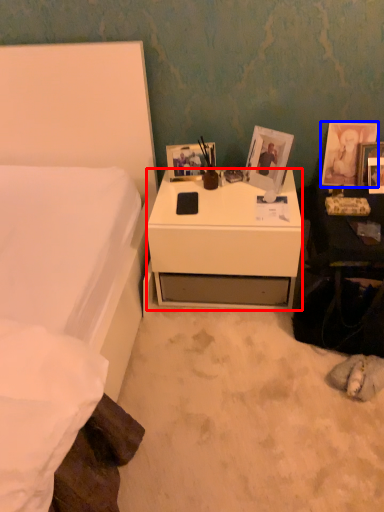
Question: Which point is closer to the camera, desk (highlighted by a red box) or picture frame (highlighted by a blue box)?

Choices:
 (A) desk
 (B) picture frame

Answer: (A)